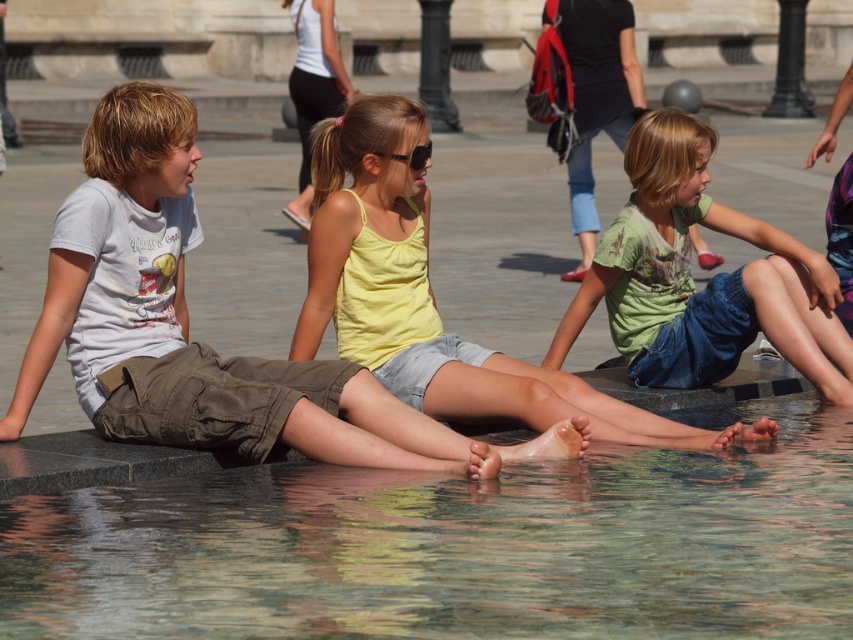
Question: Which object is closer to the camera taking this photo?

Choices:
 (A) yellow cotton tank top at center
 (B) green cotton shirt at center
 (C) clear glass water at lower center

Answer: (C)

Question: Observing the image, what is the correct spatial positioning of clear glass water at lower center in reference to light brown cotton shorts at center?

Choices:
 (A) left
 (B) right

Answer: (B)

Question: Which object is the closest to the light brown cotton shorts at center?

Choices:
 (A) green cotton shirt at center
 (B) yellow cotton tank top at center
 (C) clear glass water at lower center

Answer: (B)

Question: Is clear glass water at lower center below yellow cotton tank top at center?

Choices:
 (A) yes
 (B) no

Answer: (A)

Question: Does clear glass water at lower center appear under green cotton shirt at center?

Choices:
 (A) no
 (B) yes

Answer: (B)

Question: Which of the following is the closest to the observer?

Choices:
 (A) (415, 449)
 (B) (670, 304)
 (C) (496, 602)
 (D) (445, 339)

Answer: (C)